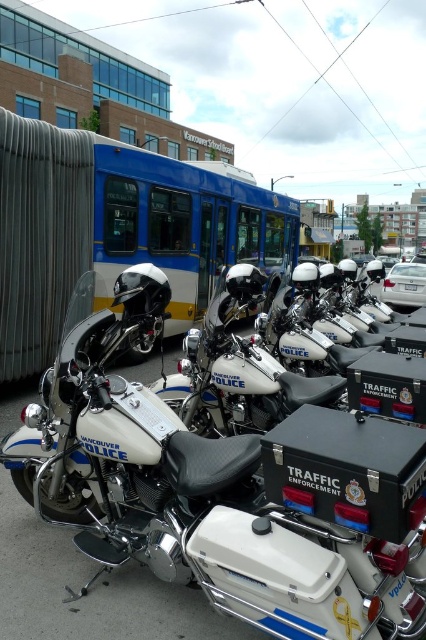
Can you confirm if white metallic police motorcycle at center is positioned to the right of white matte police motorcycle at center?

Incorrect, white metallic police motorcycle at center is not on the right side of white matte police motorcycle at center.

Which is behind, point (270, 600) or point (198, 352)?

The point (198, 352) is more distant.

Locate an element on the screen. The width and height of the screenshot is (426, 640). white metallic police motorcycle at center is located at coordinates (226, 497).

Is blue metallic bus at upper center smaller than white matte police motorcycle at center?

No, blue metallic bus at upper center is not smaller than white matte police motorcycle at center.

Can you confirm if blue metallic bus at upper center is positioned below white matte police motorcycle at center?

No.

Measure the distance between blue metallic bus at upper center and camera.

They are 3.03 meters apart.

Locate an element on the screen. blue metallic bus at upper center is located at coordinates (184, 225).

Is point (143, 433) behind point (198, 188)?

No, (143, 433) is in front of (198, 188).

Measure the distance between white metallic police motorcycle at center and camera.

The distance of white metallic police motorcycle at center from camera is 1.60 meters.

You are a GUI agent. You are given a task and a screenshot of the screen. Output one action in this format:
    pyautogui.click(x=<x>, y=<y>)
    Task: Click on the white metallic police motorcycle at center
    This screenshot has height=640, width=426.
    Given the screenshot: What is the action you would take?
    pyautogui.click(x=226, y=497)